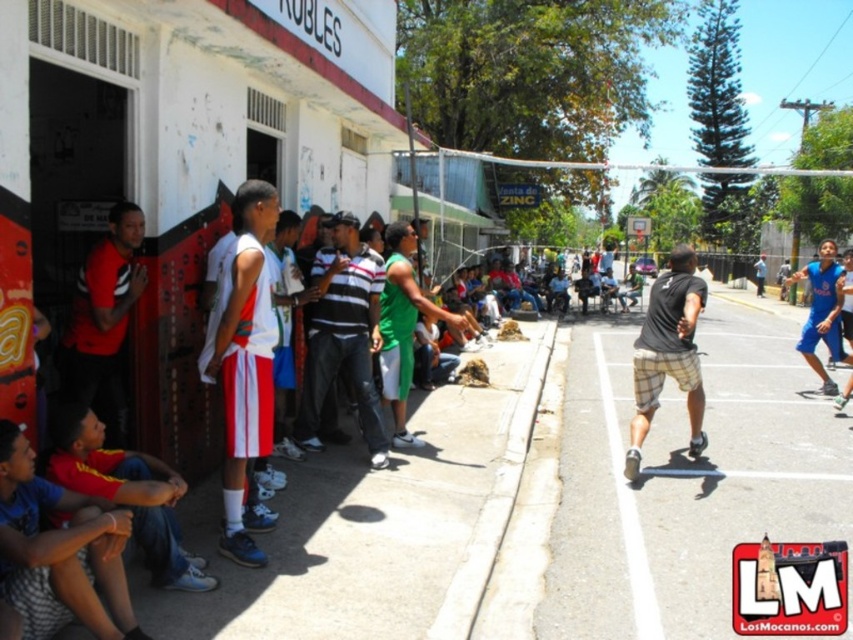
You are a photographer trying to capture a candid shot of the scene. You notice two people wearing shorts in the crowd. The first person has matte blue shorts at lower left, and the second has plaid shorts at center. Which person do you think is closer to the camera based on their spatial positioning?

The matte blue shorts at lower left occupies less space than plaid shorts at center, so the person wearing plaid shorts at center is closer to the camera because objects closer to the camera appear larger and occupy more space in the image.

You are a photographer standing at the center of the street scene. You want to capture a photo that includes the matte blue shorts at lower left. Based on their position, where should you aim your camera to ensure they are in the frame?

The matte blue shorts at lower left are located at point 2D coordinates of [59,552]. To include them in the frame, aim your camera towards the lower left area of the scene, specifically focusing on the coordinates mentioned.